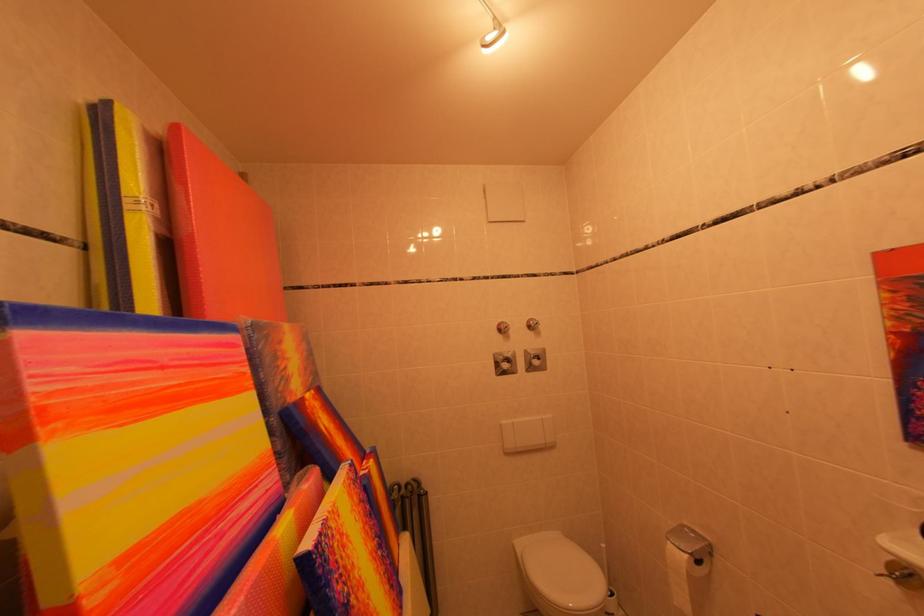
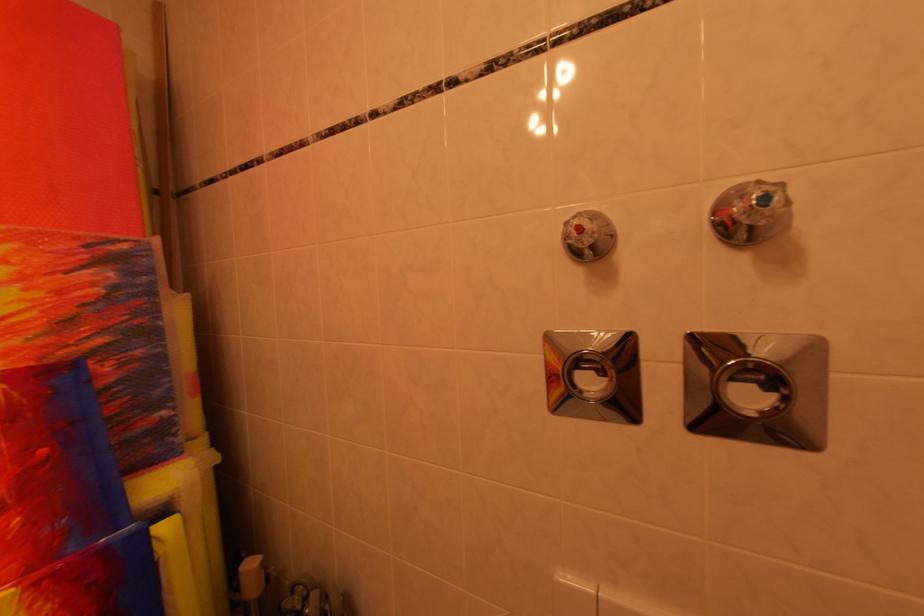
In the second image, find the point that corresponds to [545,328] in the first image.

(773, 201)